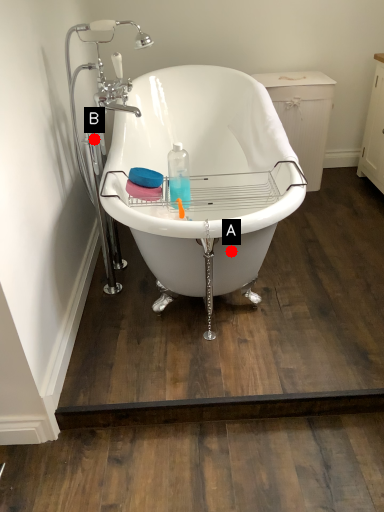
Question: Two points are circled on the image, labeled by A and B beside each circle. Which point is further to the camera?

Choices:
 (A) A is further
 (B) B is further

Answer: (B)